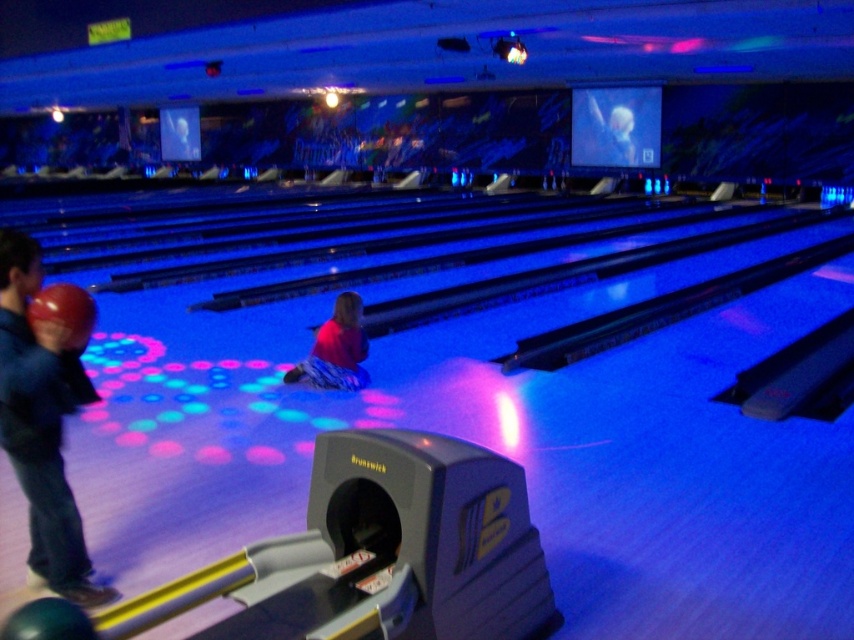
In the scene shown: You are a photographer setting up a camera to capture the scene at the bowling alley. You want to ensure that both the blue denim jeans at lower left and the matte pink shirt at center are in focus. Based on their positions, which object is closer to the camera and might require adjusting the focus accordingly?

The blue denim jeans at lower left are closer to the camera than the matte pink shirt at center, so you should adjust the focus to ensure both are sharp.

You are a photographer trying to capture the scene from the bowling alley. You notice the blue denim jeans at lower left and the matte pink shirt at center. Which object is closer to the camera based on their positions?

The blue denim jeans at lower left is positioned under the matte pink shirt at center, so the blue denim jeans at lower left is closer to the camera.

You are a photographer setting up a shot in the bowling alley. You have two subjects to focus on, the blue denim jeans at lower left and the matte pink shirt at center. Which subject should you adjust your camera settings for to account for height differences?

The blue denim jeans at lower left is much taller than the matte pink shirt at center, so you should adjust your camera settings to focus on the taller blue denim jeans at lower left.